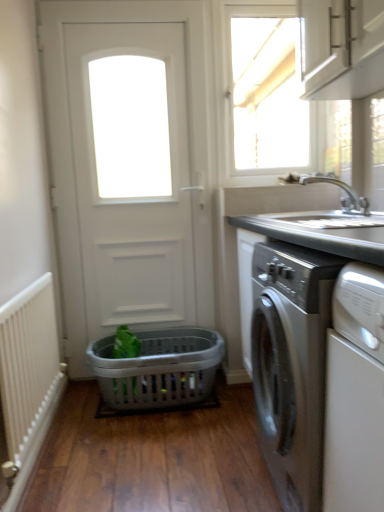
Where is `vacant area in front of gray plastic laundry basket at center`? vacant area in front of gray plastic laundry basket at center is located at coordinates (145, 455).